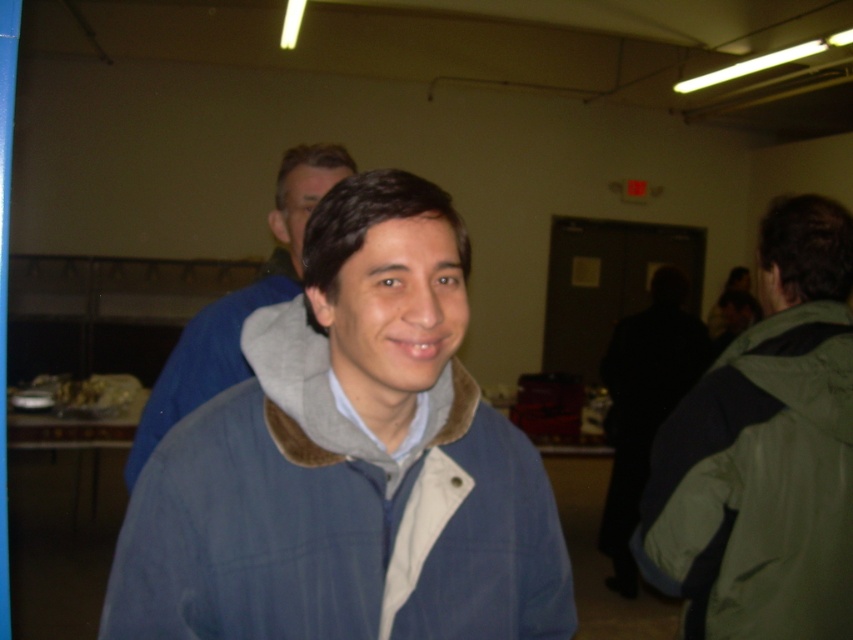
Question: Which of these objects is positioned farthest from the blue corduroy jacket at center?

Choices:
 (A) blue fleece jacket at center
 (B) green matte jacket at right

Answer: (B)

Question: Is blue corduroy jacket at center below green matte jacket at right?

Choices:
 (A) no
 (B) yes

Answer: (A)

Question: Is blue corduroy jacket at center bigger than blue fleece jacket at center?

Choices:
 (A) yes
 (B) no

Answer: (B)

Question: Which point is farther from the camera taking this photo?

Choices:
 (A) (171, 388)
 (B) (463, 406)
 (C) (813, 552)

Answer: (A)

Question: Is green matte jacket at right below blue fleece jacket at center?

Choices:
 (A) yes
 (B) no

Answer: (A)

Question: Which object appears closest to the camera in this image?

Choices:
 (A) blue corduroy jacket at center
 (B) green matte jacket at right
 (C) blue fleece jacket at center

Answer: (A)